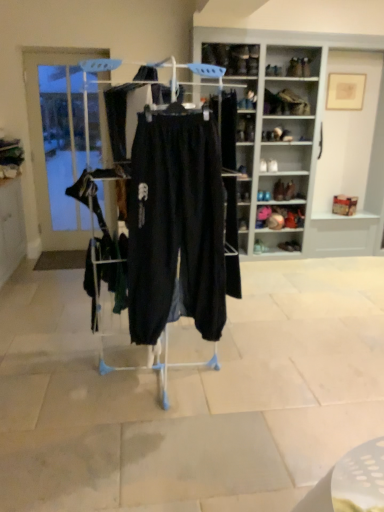
Question: Is matte black shoe at center, the 3th footwear from the left, far from clear glass door at left?

Choices:
 (A) yes
 (B) no

Answer: (A)

Question: Does matte black shoe at center, the first footwear from the top, have a greater width compared to clear glass door at left?

Choices:
 (A) no
 (B) yes

Answer: (B)

Question: Is matte black shoe at center, marked as the 4th footwear in a bottom-to-top arrangement, aimed at clear glass door at left?

Choices:
 (A) yes
 (B) no

Answer: (B)

Question: From a real-world perspective, is matte black shoe at center, the second footwear viewed from the right, on top of clear glass door at left?

Choices:
 (A) no
 (B) yes

Answer: (A)

Question: Considering the relative sizes of matte black shoe at center, marked as the 4th footwear in a bottom-to-top arrangement, and clear glass door at left in the image provided, is matte black shoe at center, marked as the 4th footwear in a bottom-to-top arrangement, thinner than clear glass door at left?

Choices:
 (A) no
 (B) yes

Answer: (A)

Question: From the image's perspective, is matte black shoe at center, the first footwear from the top, above or below matte black shoe at center, which ranks as the second shelf in top-to-bottom order?

Choices:
 (A) below
 (B) above

Answer: (B)

Question: Would you say matte black shoe at center, the second footwear viewed from the right, is inside or outside matte black shoe at center, which appears as the first shelf when ordered from the bottom?

Choices:
 (A) outside
 (B) inside

Answer: (A)

Question: From a real-world perspective, relative to matte black shoe at center, which ranks as the second shelf in top-to-bottom order, is matte black shoe at center, marked as the 4th footwear in a bottom-to-top arrangement, vertically above or below?

Choices:
 (A) below
 (B) above

Answer: (B)

Question: Is point (286, 187) closer or farther from the camera than point (238, 227)?

Choices:
 (A) farther
 (B) closer

Answer: (A)

Question: Is matte black shoe at center, the second footwear viewed from the right, taller or shorter than black cotton pants at center?

Choices:
 (A) tall
 (B) short

Answer: (B)

Question: Does point (291, 194) appear closer or farther from the camera than point (180, 228)?

Choices:
 (A) closer
 (B) farther

Answer: (B)

Question: Based on their positions, is matte black shoe at center, marked as the 4th footwear in a bottom-to-top arrangement, located to the left or right of black cotton pants at center?

Choices:
 (A) left
 (B) right

Answer: (B)

Question: From the image's perspective, is matte black shoe at center, marked as the 4th footwear in a bottom-to-top arrangement, above or below black cotton pants at center?

Choices:
 (A) below
 (B) above

Answer: (B)

Question: From a real-world perspective, is matte black shoe at center, which is counted as the 4th footwear, starting from the right, positioned above or below matte black shoe at center, the second footwear viewed from the right?

Choices:
 (A) below
 (B) above

Answer: (A)

Question: Is point (261, 247) positioned closer to the camera than point (284, 192)?

Choices:
 (A) closer
 (B) farther

Answer: (B)